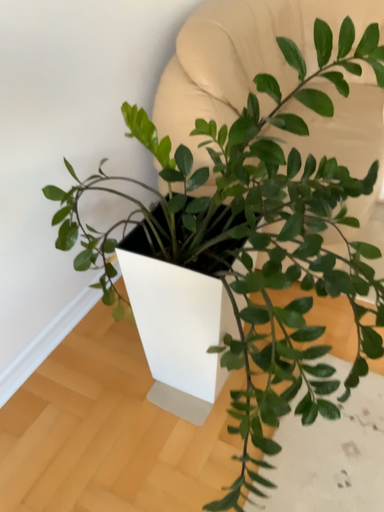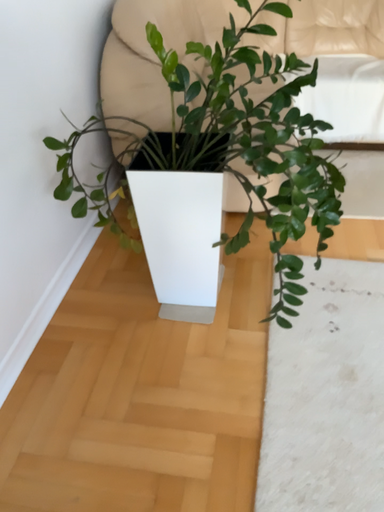
Question: How did the camera likely rotate when shooting the video?

Choices:
 (A) rotated left
 (B) rotated right

Answer: (B)